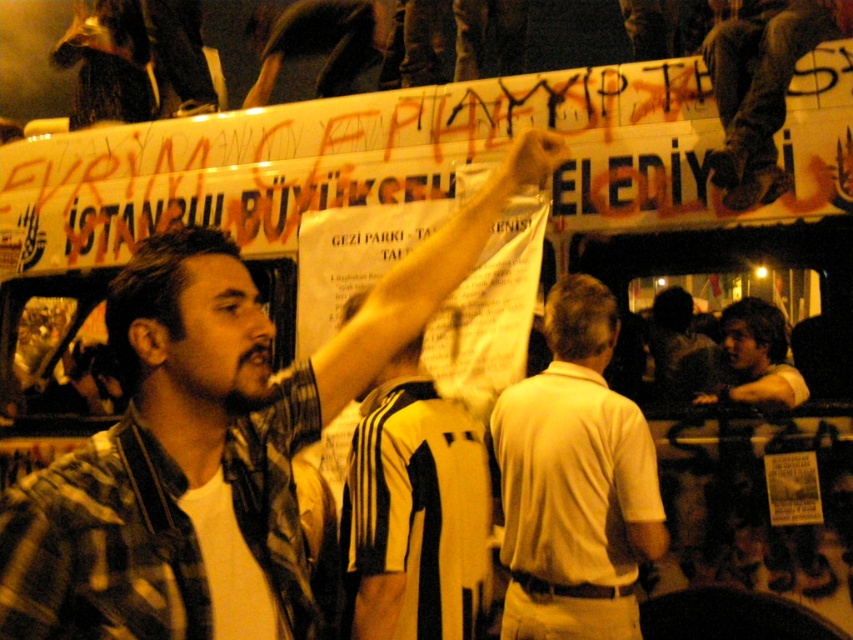
Who is taller, plaid shirt at center or white matte shirt at center?

plaid shirt at center

Based on the photo, can you confirm if plaid shirt at center is bigger than white matte shirt at center?

Indeed, plaid shirt at center has a larger size compared to white matte shirt at center.

What are the coordinates of `plaid shirt at center` in the screenshot? It's located at (212, 438).

Who is higher up, dark brown leather pants at upper right or white shirt at center?

Positioned higher is dark brown leather pants at upper right.

Does point (743, 112) come closer to viewer compared to point (782, 372)?

Yes, it is in front of point (782, 372).

Where is `dark brown leather pants at upper right`? The width and height of the screenshot is (853, 640). dark brown leather pants at upper right is located at coordinates (759, 84).

Is white matte shirt at center to the right of white shirt at center from the viewer's perspective?

Incorrect, white matte shirt at center is not on the right side of white shirt at center.

Does white matte shirt at center have a lesser width compared to white shirt at center?

No, white matte shirt at center is not thinner than white shirt at center.

What do you see at coordinates (575, 481) in the screenshot? I see `white matte shirt at center` at bounding box center [575, 481].

You are a GUI agent. You are given a task and a screenshot of the screen. Output one action in this format:
    pyautogui.click(x=<x>, y=<y>)
    Task: Click on the white matte shirt at center
    
    Given the screenshot: What is the action you would take?
    pyautogui.click(x=575, y=481)